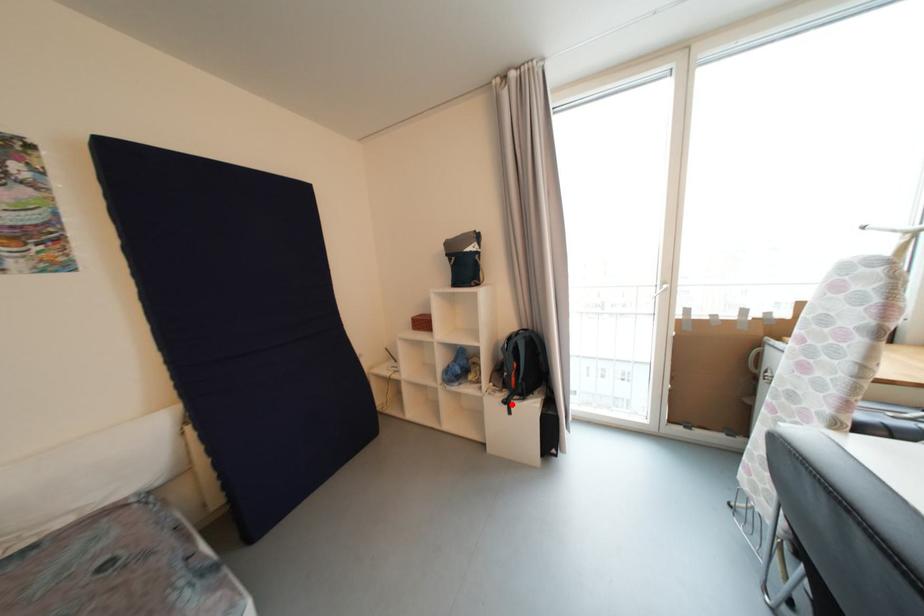
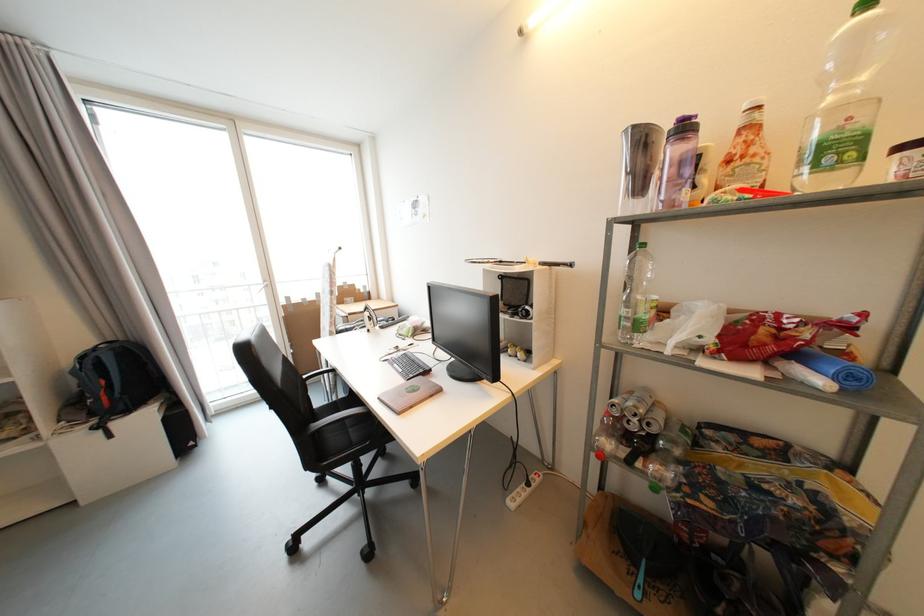
Question: I am providing you with two images of the same scene from different viewpoints. In image1, a red point is highlighted. Considering the same 3D point in image2, which of the following is correct?

Choices:
 (A) It is closer
 (B) It is farther

Answer: (A)